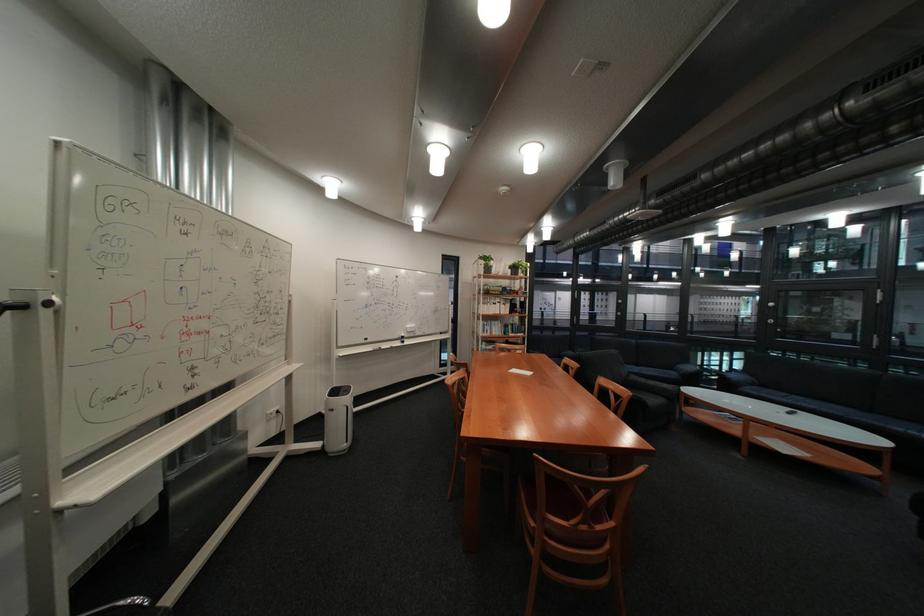
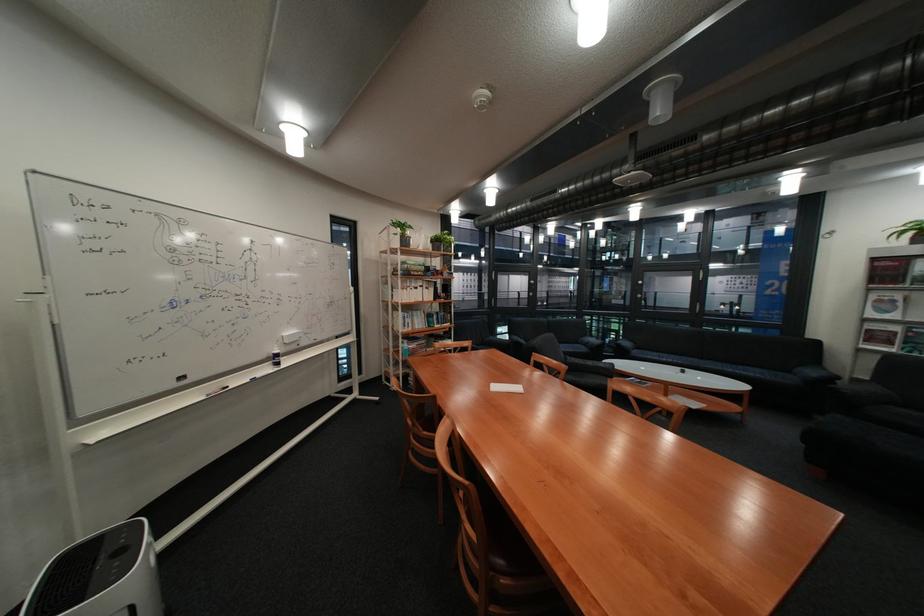
The images are taken continuously from a first-person perspective. In which direction are you moving?

The cameraman walked toward left, forward.